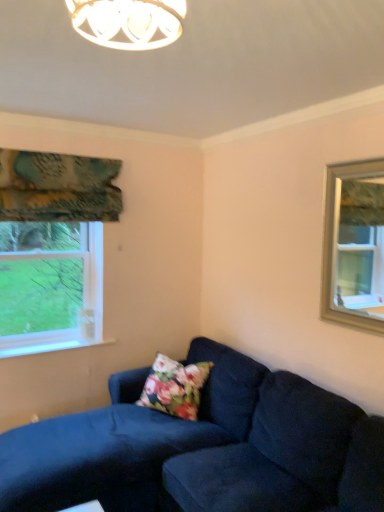
Question: Is teal floral fabric at upper left to the right of clear glass window at upper right from the viewer's perspective?

Choices:
 (A) yes
 (B) no

Answer: (B)

Question: Are teal floral fabric at upper left and clear glass window at upper right located far from each other?

Choices:
 (A) no
 (B) yes

Answer: (B)

Question: From the image's perspective, does teal floral fabric at upper left appear higher than clear glass window at upper right?

Choices:
 (A) no
 (B) yes

Answer: (B)

Question: Is teal floral fabric at upper left turned away from clear glass window at upper right?

Choices:
 (A) no
 (B) yes

Answer: (A)

Question: Can you confirm if teal floral fabric at upper left is bigger than clear glass window at upper right?

Choices:
 (A) no
 (B) yes

Answer: (B)

Question: From a real-world perspective, is clear glass window at upper right positioned above or below suede dark blue couch at lower right?

Choices:
 (A) below
 (B) above

Answer: (B)

Question: Considering the positions of clear glass window at upper right and suede dark blue couch at lower right in the image, is clear glass window at upper right wider or thinner than suede dark blue couch at lower right?

Choices:
 (A) thin
 (B) wide

Answer: (A)

Question: Is clear glass window at upper right situated inside suede dark blue couch at lower right or outside?

Choices:
 (A) inside
 (B) outside

Answer: (B)

Question: Is clear glass window at upper right to the left or to the right of suede dark blue couch at lower right in the image?

Choices:
 (A) right
 (B) left

Answer: (A)

Question: Choose the correct answer: Is teal floral fabric at upper left inside floral fabric pillow at lower center or outside it?

Choices:
 (A) outside
 (B) inside

Answer: (A)

Question: From the image's perspective, is teal floral fabric at upper left positioned above or below floral fabric pillow at lower center?

Choices:
 (A) above
 (B) below

Answer: (A)

Question: Considering their positions, is teal floral fabric at upper left located in front of or behind floral fabric pillow at lower center?

Choices:
 (A) behind
 (B) front

Answer: (B)

Question: Considering the positions of teal floral fabric at upper left and floral fabric pillow at lower center in the image, is teal floral fabric at upper left wider or thinner than floral fabric pillow at lower center?

Choices:
 (A) wide
 (B) thin

Answer: (B)

Question: Is floral fabric pillow at lower center to the left or to the right of suede dark blue couch at lower right in the image?

Choices:
 (A) right
 (B) left

Answer: (B)

Question: From the image's perspective, is floral fabric pillow at lower center above or below suede dark blue couch at lower right?

Choices:
 (A) below
 (B) above

Answer: (B)